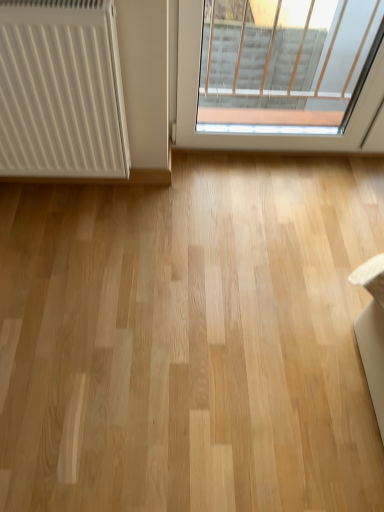
Based on the photo, what is the approximate height of white matte radiator at left?

The height of white matte radiator at left is 26.72 inches.

Describe the element at coordinates (61, 90) in the screenshot. This screenshot has height=512, width=384. I see `white matte radiator at left` at that location.

You are a GUI agent. You are given a task and a screenshot of the screen. Output one action in this format:
    pyautogui.click(x=<x>, y=<y>)
    Task: Click on the white matte radiator at left
    This screenshot has height=512, width=384.
    Given the screenshot: What is the action you would take?
    pyautogui.click(x=61, y=90)

Locate an element on the screen. Image resolution: width=384 pixels, height=512 pixels. white matte radiator at left is located at coordinates (61, 90).